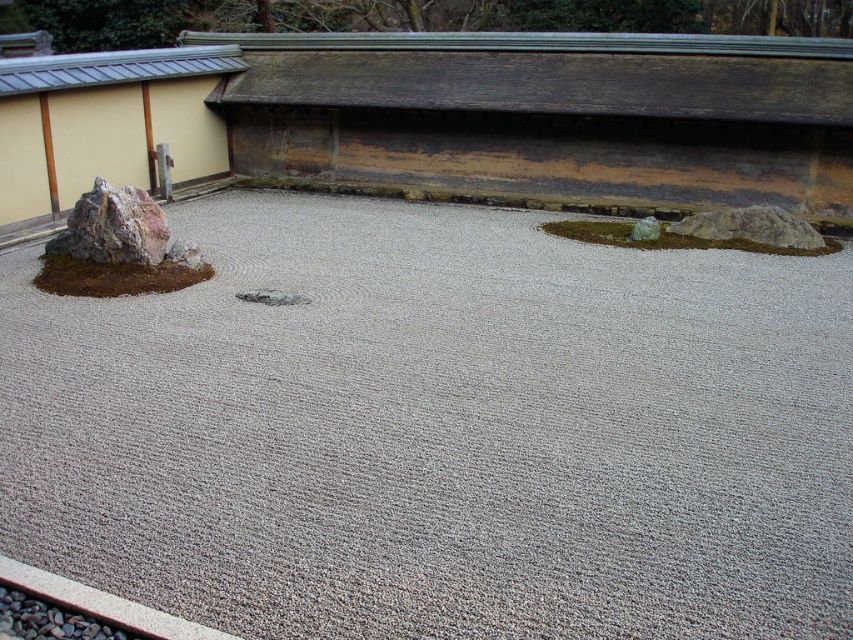
Question: Considering the relative positions of gray rough rock at right and gray gravel at bottom left in the image provided, where is gray rough rock at right located with respect to gray gravel at bottom left?

Choices:
 (A) above
 (B) below

Answer: (A)

Question: Among these points, which one is nearest to the camera?

Choices:
 (A) (41, 625)
 (B) (647, 221)
 (C) (738, 220)

Answer: (A)

Question: Is gray gravel at center further to the viewer compared to smooth gray rock at center-right?

Choices:
 (A) yes
 (B) no

Answer: (B)

Question: Can you confirm if gray rough rock at right is thinner than smooth gray rock at center-right?

Choices:
 (A) yes
 (B) no

Answer: (B)

Question: Among these points, which one is nearest to the camera?

Choices:
 (A) (764, 209)
 (B) (641, 230)

Answer: (B)

Question: Which point is closer to the camera?

Choices:
 (A) (1, 296)
 (B) (20, 611)
 (C) (749, 227)

Answer: (B)